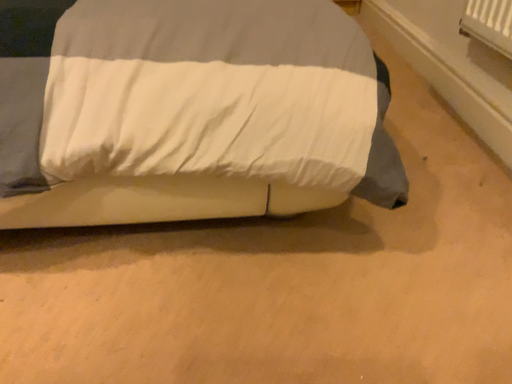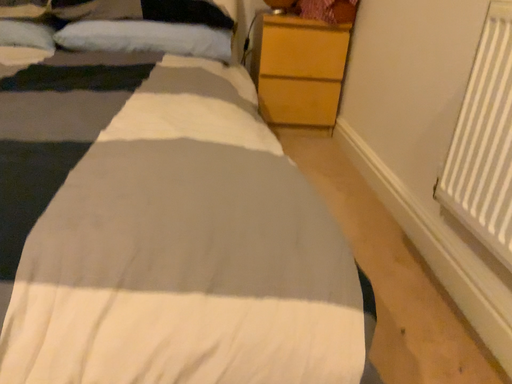
Question: Which way did the camera rotate in the video?

Choices:
 (A) rotated downward
 (B) rotated upward

Answer: (B)